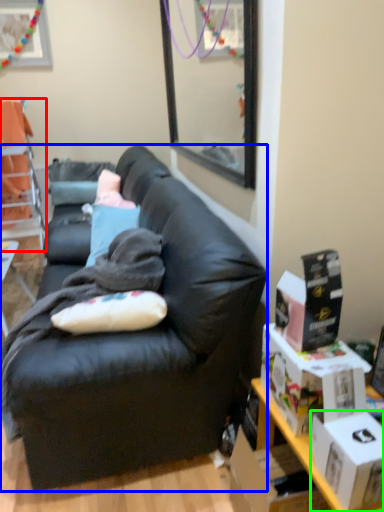
Question: Based on their relative distances, which object is nearer to chair (highlighted by a red box)? Choose from studio couch (highlighted by a blue box) and box (highlighted by a green box).

Choices:
 (A) studio couch
 (B) box

Answer: (A)